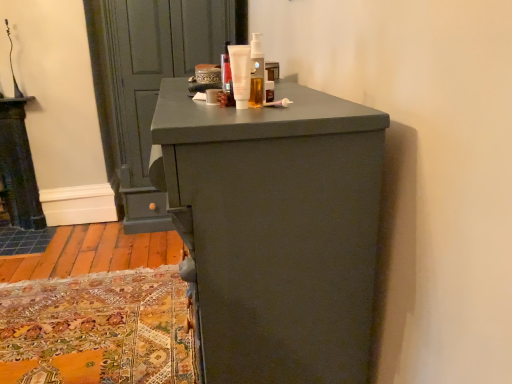
What are the coordinates of `free space to the left of matte white cream at center, placed as the 3th toiletry when sorted from right to left` in the screenshot? It's located at (179, 102).